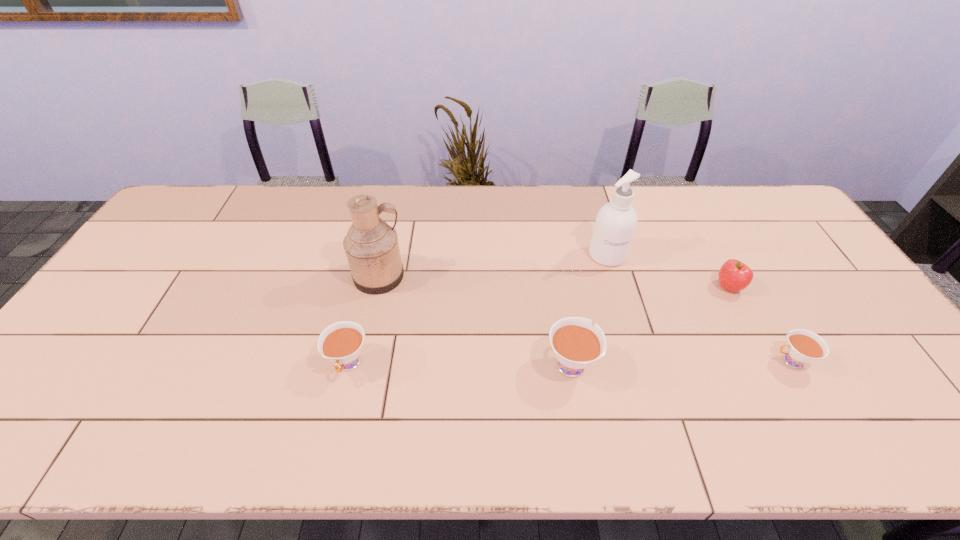
The height and width of the screenshot is (540, 960). Identify the location of vacant space at the right edge. (826, 332).

This screenshot has height=540, width=960. Find the location of `blank region between the cleansing agent and the second shortest teacup`. blank region between the cleansing agent and the second shortest teacup is located at coordinates (478, 309).

Identify the location of free spot between the second teacup from left to right and the leftmost teacup. (460, 363).

This screenshot has height=540, width=960. Identify the location of vacant area that lies between the apple and the fourth object from left to right. (668, 271).

Locate an element on the screen. The height and width of the screenshot is (540, 960). free area in between the apple and the pitcher is located at coordinates (554, 282).

Where is `vacant point located between the apple and the second shortest teacup`? vacant point located between the apple and the second shortest teacup is located at coordinates (539, 326).

I want to click on vacant region between the pitcher and the second shortest teacup, so click(364, 320).

Locate an element on the screen. This screenshot has width=960, height=540. vacant space in between the apple and the pitcher is located at coordinates (554, 282).

Identify which object is the nearest to the rightmost teacup. Please provide its 2D coordinates. Your answer should be formatted as a tuple, i.e. [(x, y)], where the tuple contains the x and y coordinates of a point satisfying the conditions above.

[(733, 276)]

At what (x,y) coordinates should I click in order to perform the action: click on object that is the fifth closest one to the pitcher. Please return your answer as a coordinate pair (x, y). Looking at the image, I should click on (803, 346).